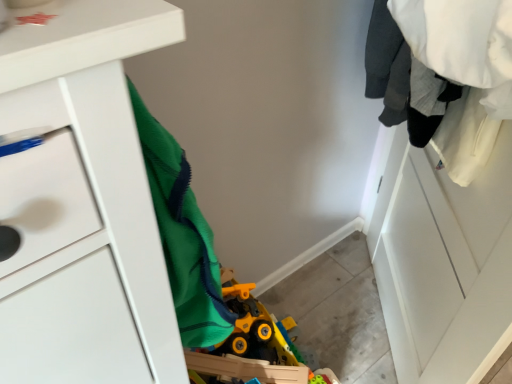
Question: From a real-world perspective, relative to white matte chest of drawers at left, is white matte clothes at upper right vertically above or below?

Choices:
 (A) below
 (B) above

Answer: (A)

Question: Choose the correct answer: Is white matte clothes at upper right inside white matte chest of drawers at left or outside it?

Choices:
 (A) inside
 (B) outside

Answer: (B)

Question: In terms of width, does white matte clothes at upper right look wider or thinner when compared to white matte chest of drawers at left?

Choices:
 (A) wide
 (B) thin

Answer: (B)

Question: Does point [x=7, y=100] appear closer or farther from the camera than point [x=421, y=29]?

Choices:
 (A) farther
 (B) closer

Answer: (B)

Question: In the image, is white matte chest of drawers at left positioned in front of or behind white matte clothes at upper right?

Choices:
 (A) front
 (B) behind

Answer: (A)

Question: From the image's perspective, is white matte chest of drawers at left above or below white matte clothes at upper right?

Choices:
 (A) below
 (B) above

Answer: (B)

Question: Do you think white matte chest of drawers at left is within white matte clothes at upper right, or outside of it?

Choices:
 (A) outside
 (B) inside

Answer: (A)